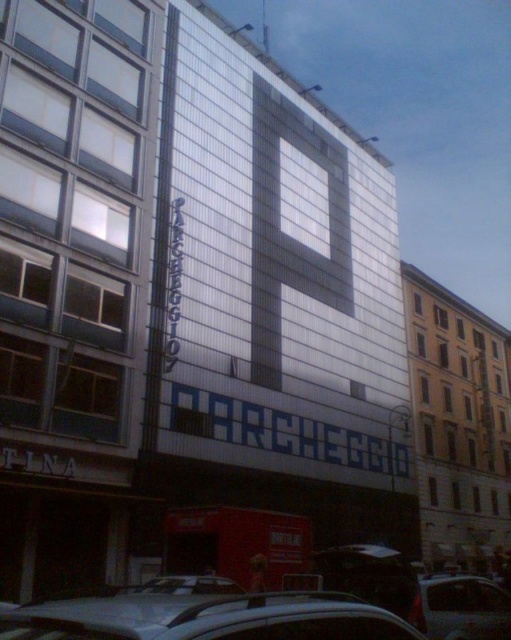
Which of these two, silver metallic car at lower center or metallic gray sedan at lower right, stands shorter?

silver metallic car at lower center

Can you confirm if silver metallic car at lower center is taller than metallic gray sedan at lower right?

Incorrect, silver metallic car at lower center's height is not larger of metallic gray sedan at lower right's.

At what (x,y) coordinates should I click in order to perform the action: click on silver metallic car at lower center. Please return your answer as a coordinate pair (x, y). The height and width of the screenshot is (640, 511). Looking at the image, I should click on (206, 618).